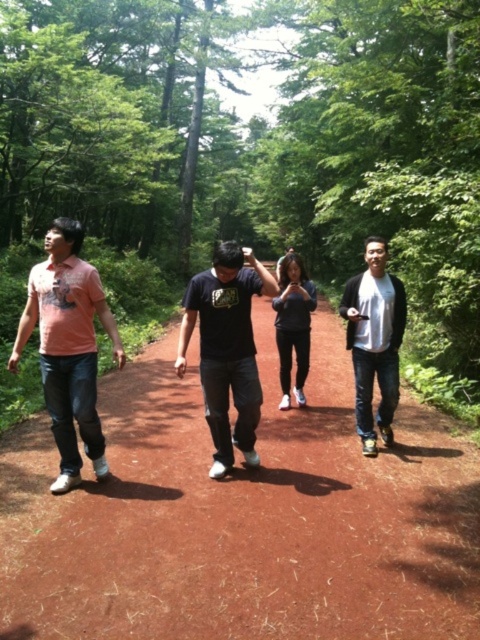
You are a photographer trying to capture a photo of the matte pink shirt at left and the dark gray fabric pants at center. From which side should you position yourself to ensure both subjects are fully visible in the frame?

You should position yourself to the right side of the dark gray fabric pants at center because the matte pink shirt at left is on the left side of it, ensuring both are visible in the frame.